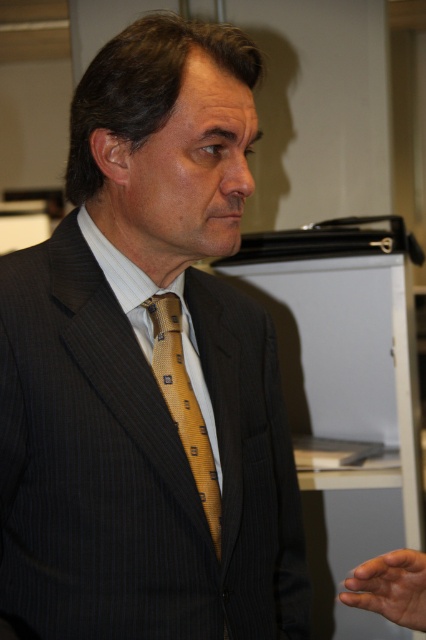
Question: Which point appears farthest from the camera in this image?

Choices:
 (A) (215, 508)
 (B) (172, 301)

Answer: (B)

Question: Which point is closer to the camera?

Choices:
 (A) (210, 419)
 (B) (132, 432)
 (C) (150, 298)

Answer: (B)

Question: Is pinstriped suit at center further to the viewer compared to white silk dress shirt at center?

Choices:
 (A) no
 (B) yes

Answer: (A)

Question: Can you confirm if pinstriped suit at center is positioned to the left of gold woven tie at center?

Choices:
 (A) yes
 (B) no

Answer: (A)

Question: Where is pinstriped suit at center located in relation to white silk dress shirt at center in the image?

Choices:
 (A) above
 (B) below

Answer: (A)

Question: Which object is closer to the camera taking this photo?

Choices:
 (A) pinstriped suit at center
 (B) white silk dress shirt at center
 (C) gold woven tie at center

Answer: (A)